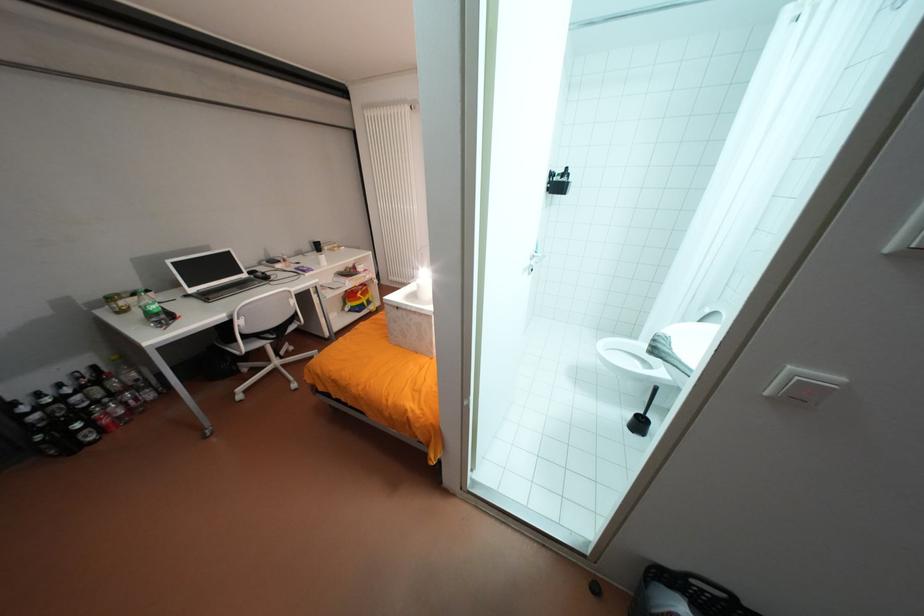
Find where to clos the gray laptop. Please return your answer as a coordinate pair (x, y).

(213, 275)